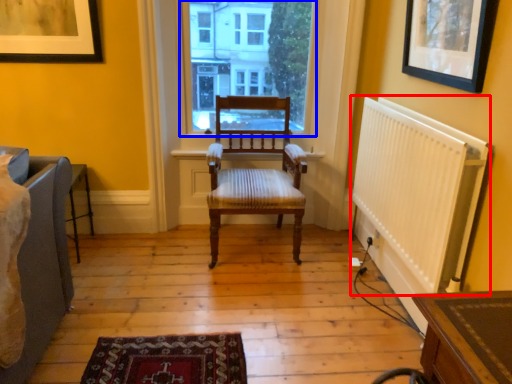
Question: Which object is closer to the camera taking this photo, radiator (highlighted by a red box) or window (highlighted by a blue box)?

Choices:
 (A) radiator
 (B) window

Answer: (A)